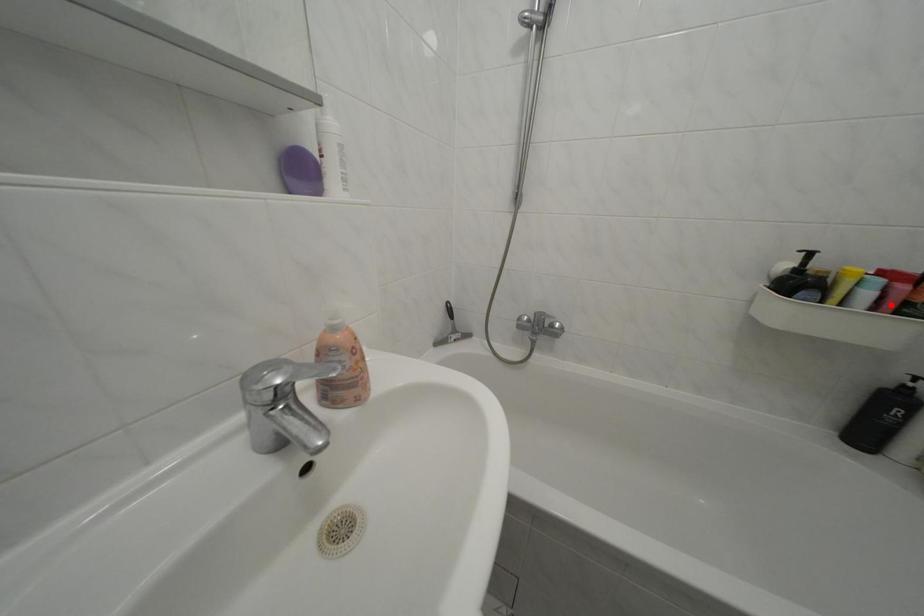
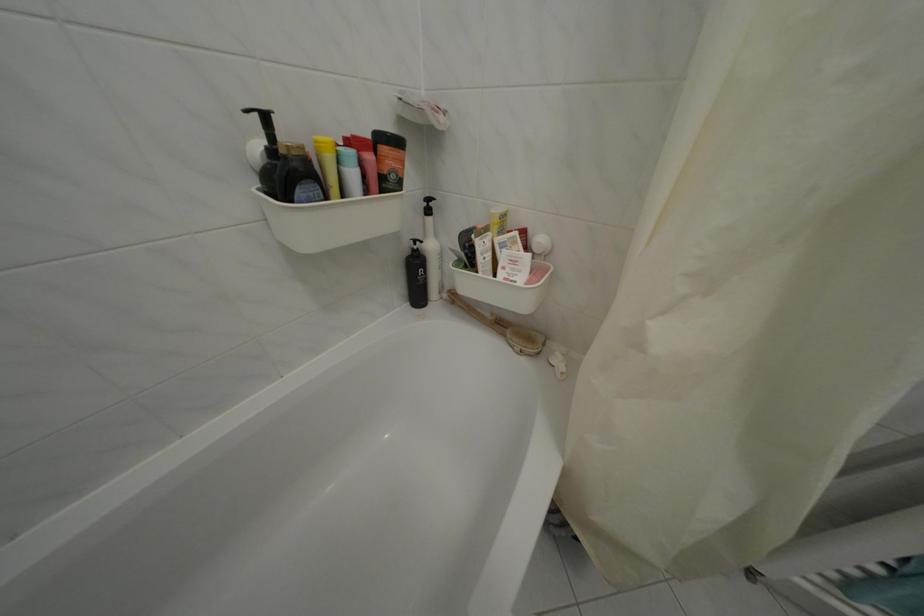
Question: I am providing you with two images of the same scene from different viewpoints. Given a red point in image1, look at the same physical point in image2. Is it:

Choices:
 (A) Closer to the viewpoint
 (B) Farther from the viewpoint

Answer: (A)